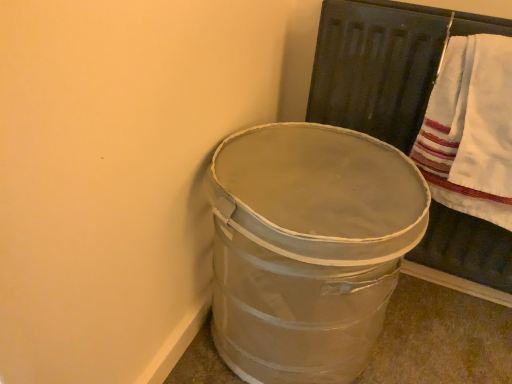
Where is `white cotton towel at upper right`? white cotton towel at upper right is located at coordinates (471, 129).

The width and height of the screenshot is (512, 384). Describe the element at coordinates (471, 129) in the screenshot. I see `white cotton towel at upper right` at that location.

Measure the distance between metallic silver bucket at lower right and camera.

The depth of metallic silver bucket at lower right is 29.46 inches.

This screenshot has height=384, width=512. What do you see at coordinates (308, 248) in the screenshot?
I see `metallic silver bucket at lower right` at bounding box center [308, 248].

Image resolution: width=512 pixels, height=384 pixels. Find the location of `metallic silver bucket at lower right`. metallic silver bucket at lower right is located at coordinates (308, 248).

Locate an element on the screen. white cotton towel at upper right is located at coordinates (471, 129).

Based on their positions, is white cotton towel at upper right located to the left or right of metallic silver bucket at lower right?

Clearly, white cotton towel at upper right is on the right of metallic silver bucket at lower right in the image.

Which object is closer to the camera taking this photo, white cotton towel at upper right or metallic silver bucket at lower right?

metallic silver bucket at lower right is closer to the camera.

Is point (429, 110) closer or farther from the camera than point (306, 130)?

Point (429, 110) is closer to the camera than point (306, 130).

From the image's perspective, is white cotton towel at upper right above or below metallic silver bucket at lower right?

From the image's perspective, white cotton towel at upper right appears above metallic silver bucket at lower right.

From a real-world perspective, is white cotton towel at upper right positioned under metallic silver bucket at lower right based on gravity?

No.

Looking at their sizes, would you say white cotton towel at upper right is wider or thinner than metallic silver bucket at lower right?

In the image, white cotton towel at upper right appears to be more narrow than metallic silver bucket at lower right.

Considering the relative sizes of white cotton towel at upper right and metallic silver bucket at lower right in the image provided, is white cotton towel at upper right shorter than metallic silver bucket at lower right?

Indeed, white cotton towel at upper right has a lesser height compared to metallic silver bucket at lower right.

Which of these two, white cotton towel at upper right or metallic silver bucket at lower right, is smaller?

With smaller size is white cotton towel at upper right.

Is metallic silver bucket at lower right completely or partially inside white cotton towel at upper right?

No, metallic silver bucket at lower right is not surrounded by white cotton towel at upper right.

Is white cotton towel at upper right positioned far away from metallic silver bucket at lower right?

They are positioned close to each other.

Is white cotton towel at upper right aimed at metallic silver bucket at lower right?

No.

How many degrees apart are the facing directions of white cotton towel at upper right and metallic silver bucket at lower right?

The facing directions of white cotton towel at upper right and metallic silver bucket at lower right are 88.6 degrees apart.

Find the location of a particular element. waste container in front of the white cotton towel at upper right is located at coordinates (308, 248).

Is metallic silver bucket at lower right at the left side of white cotton towel at upper right?

Indeed, metallic silver bucket at lower right is positioned on the left side of white cotton towel at upper right.

Which object is further away from the camera taking this photo, metallic silver bucket at lower right or white cotton towel at upper right?

white cotton towel at upper right is behind.

Between point (358, 364) and point (453, 118), which one is positioned behind?

The point (358, 364) is farther from the camera.

From the image's perspective, relative to white cotton towel at upper right, is metallic silver bucket at lower right above or below?

Clearly, from the image's perspective, metallic silver bucket at lower right is below white cotton towel at upper right.

From a real-world perspective, is metallic silver bucket at lower right on top of white cotton towel at upper right?

No, from a real-world perspective, metallic silver bucket at lower right is not above white cotton towel at upper right.

In terms of width, does metallic silver bucket at lower right look wider or thinner when compared to white cotton towel at upper right?

In the image, metallic silver bucket at lower right appears to be wider than white cotton towel at upper right.

Considering the sizes of objects metallic silver bucket at lower right and white cotton towel at upper right in the image provided, who is shorter, metallic silver bucket at lower right or white cotton towel at upper right?

With less height is white cotton towel at upper right.

Considering the sizes of objects metallic silver bucket at lower right and white cotton towel at upper right in the image provided, who is bigger, metallic silver bucket at lower right or white cotton towel at upper right?

With larger size is metallic silver bucket at lower right.

Is metallic silver bucket at lower right located outside white cotton towel at upper right?

metallic silver bucket at lower right is positioned outside white cotton towel at upper right.

Is metallic silver bucket at lower right positioned far away from white cotton towel at upper right?

No.

In the scene shown: Is metallic silver bucket at lower right oriented towards white cotton towel at upper right?

No, metallic silver bucket at lower right does not turn towards white cotton towel at upper right.

This screenshot has width=512, height=384. In order to click on bath towel behind the metallic silver bucket at lower right in this screenshot , I will do `click(471, 129)`.

Find the location of a particular element. waste container directly beneath the white cotton towel at upper right (from a real-world perspective) is located at coordinates (308, 248).

At what (x,y) coordinates should I click in order to perform the action: click on bath towel that appears on the right of metallic silver bucket at lower right. Please return your answer as a coordinate pair (x, y). This screenshot has height=384, width=512. Looking at the image, I should click on (471, 129).